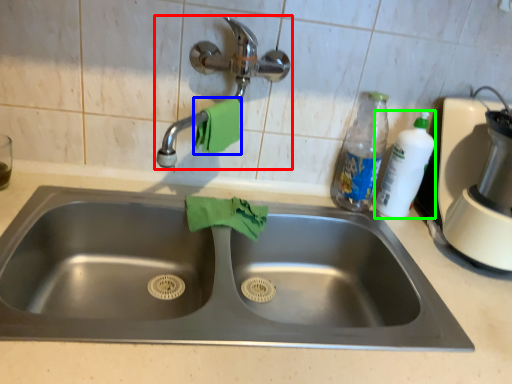
Question: Which object is positioned closest to tap (highlighted by a red box)? Select from hand towel (highlighted by a blue box) and cleaning product (highlighted by a green box).

Choices:
 (A) hand towel
 (B) cleaning product

Answer: (A)